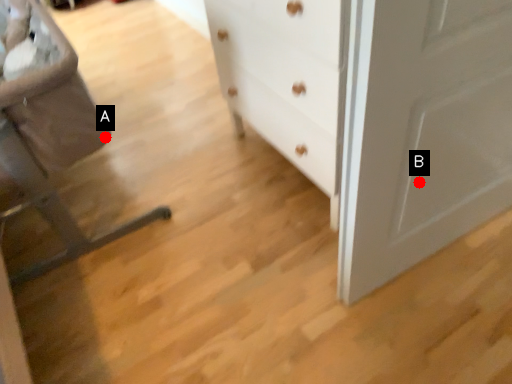
Question: Two points are circled on the image, labeled by A and B beside each circle. Which point is further to the camera?

Choices:
 (A) A is further
 (B) B is further

Answer: (A)